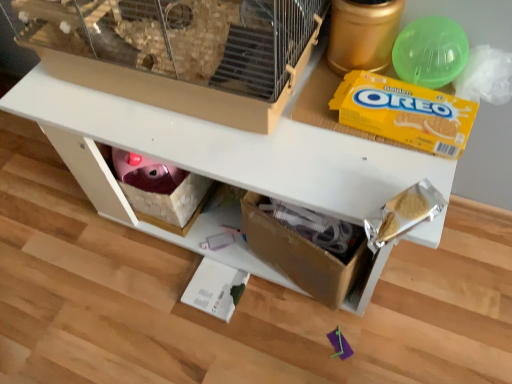
I want to click on vacant area in front of yellow cardboard oreo at upper right, so click(x=400, y=172).